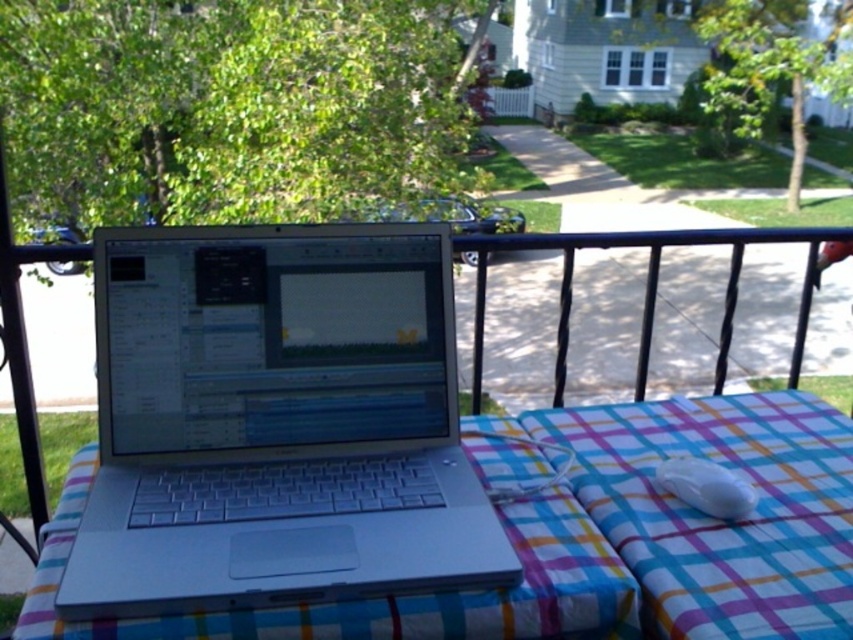
Question: Estimate the real-world distances between objects in this image. Which object is closer to the silver metallic laptop at center?

Choices:
 (A) white glossy mouse at lower right
 (B) plaid fabric at center
 (C) plaid fabric table at center

Answer: (C)

Question: Which object is the farthest from the white glossy mouse at lower right?

Choices:
 (A) plaid fabric at center
 (B) plaid fabric table at center

Answer: (B)

Question: From the image, what is the correct spatial relationship of silver metallic laptop at center in relation to plaid fabric table at center?

Choices:
 (A) above
 (B) below

Answer: (A)

Question: Among these objects, which one is nearest to the camera?

Choices:
 (A) white glossy mouse at lower right
 (B) plaid fabric at center
 (C) silver metallic laptop at center

Answer: (C)

Question: Is plaid fabric at center to the right of white glossy mouse at lower right from the viewer's perspective?

Choices:
 (A) no
 (B) yes

Answer: (A)

Question: Considering the relative positions of plaid fabric at center and white glossy mouse at lower right in the image provided, where is plaid fabric at center located with respect to white glossy mouse at lower right?

Choices:
 (A) above
 (B) below

Answer: (B)